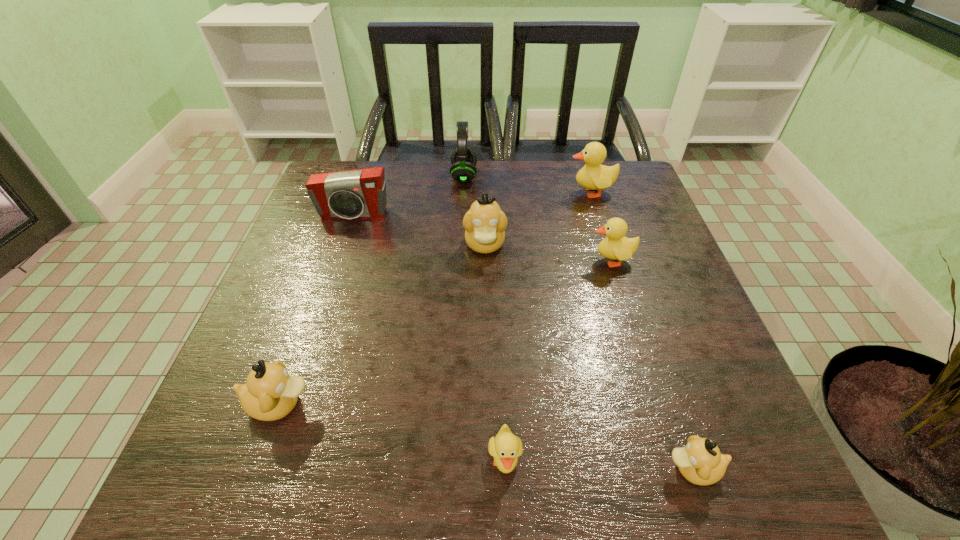
Find the location of a particular element. The height and width of the screenshot is (540, 960). object that is the seventh closest one to the second nearest yellow duckling is located at coordinates (270, 393).

Identify which object is located as the sixth nearest to the farthest tan duckling. Please provide its 2D coordinates. Your answer should be formatted as a tuple, i.e. [(x, y)], where the tuple contains the x and y coordinates of a point satisfying the conditions above.

[(506, 447)]

Identify which duckling is the nearest to the nearest tan duckling. Please provide its 2D coordinates. Your answer should be formatted as a tuple, i.e. [(x, y)], where the tuple contains the x and y coordinates of a point satisfying the conditions above.

[(506, 447)]

Point out which duckling is positioned as the fifth nearest to the farthest tan duckling. Please provide its 2D coordinates. Your answer should be formatted as a tuple, i.e. [(x, y)], where the tuple contains the x and y coordinates of a point satisfying the conditions above.

[(700, 462)]

Where is `yellow duckling that is the closest one to the farthest tan duckling`? yellow duckling that is the closest one to the farthest tan duckling is located at coordinates (616, 246).

Locate an element on the screen. The height and width of the screenshot is (540, 960). yellow duckling that stands as the closest to the second nearest yellow duckling is located at coordinates (593, 176).

Where is `tan duckling that is the nearest to the smallest yellow duckling`? tan duckling that is the nearest to the smallest yellow duckling is located at coordinates (700, 462).

The height and width of the screenshot is (540, 960). What are the coordinates of `tan duckling object that ranks as the second closest to the smallest yellow duckling` in the screenshot? It's located at (270, 393).

This screenshot has width=960, height=540. Identify the location of blank space that satisfies the following two spatial constraints: 1. on the ear cups of the black headset; 2. on the front-facing side of the camera. (462, 215).